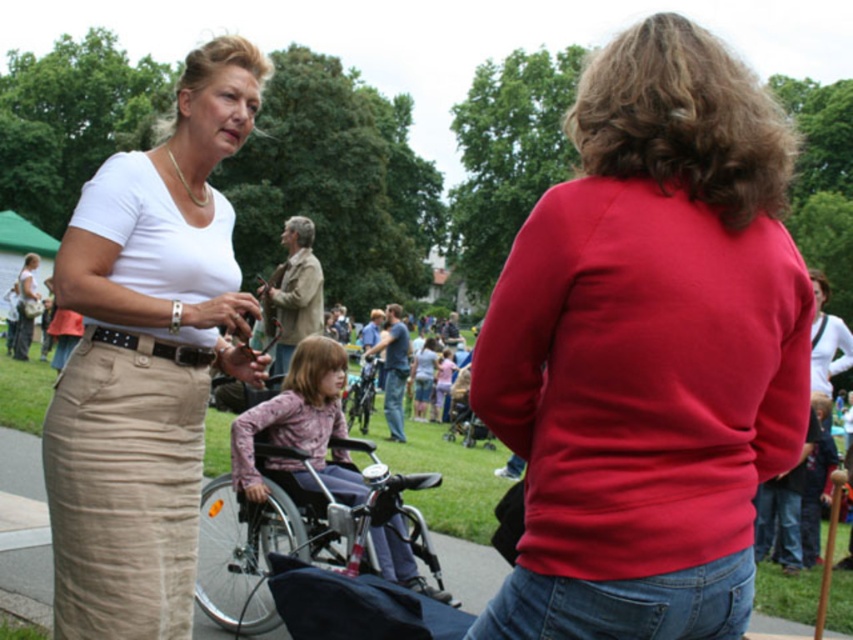
You are a photographer trying to capture the khaki cotton skirt at left and the metallic silver wheelchair at center in the same frame. Based on their positions, which object is closer to the right edge of the photo?

The khaki cotton skirt at left is positioned on the right side of the metallic silver wheelchair at center, so it is closer to the right edge of the photo.

Consider the image. You are a photographer standing at the location of the khaki cotton skirt at left. You want to take a photo of the metallic silver wheelchair at center. Is the wheelchair within your camera lens range if your camera has a maximum zoom of 1.8 meters?

The distance between khaki cotton skirt at left and metallic silver wheelchair at center is 2.13 meters, which exceeds the camera lens range of 1.8 meters. Therefore, the metallic silver wheelchair at center is out of range and cannot be captured clearly without moving closer.